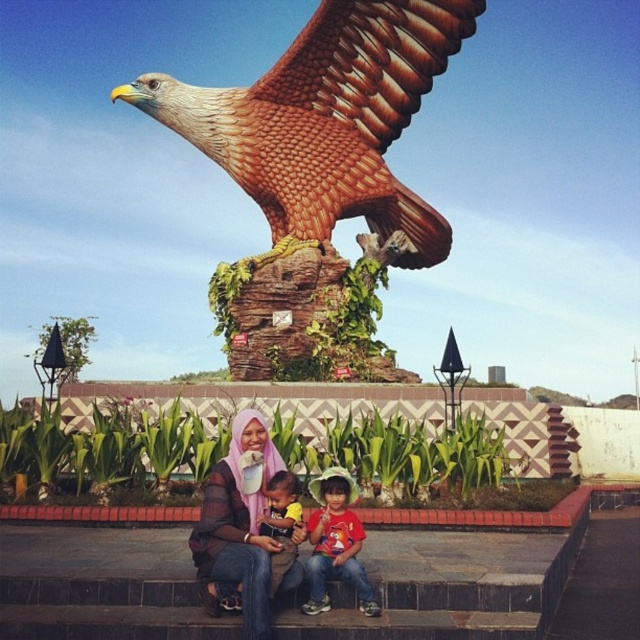
Locate an element on the screen. The height and width of the screenshot is (640, 640). brown glossy eagle at upper center is located at coordinates (326, 120).

In the scene shown: Does brown glossy eagle at upper center have a lesser width compared to red cotton shirt at center?

No, brown glossy eagle at upper center is not thinner than red cotton shirt at center.

Between point (326, 227) and point (346, 518), which one is positioned in front?

Point (346, 518) is more forward.

This screenshot has height=640, width=640. I want to click on brown glossy eagle at upper center, so click(x=326, y=120).

Who is higher up, red cotton shirt at center or soft yellow fabric shirt at center?

soft yellow fabric shirt at center is above.

Is point (360, 524) less distant than point (262, 518)?

No, (360, 524) is further to viewer.

Which is behind, point (340, 490) or point (285, 474)?

The point (285, 474) is behind.

I want to click on red cotton shirt at center, so click(x=336, y=548).

From the picture: Is brown glossy eagle at upper center behind pink sheer hijab at center?

Yes.

Who is more distant from viewer, [268,145] or [243,579]?

The point [268,145] is behind.

Find the location of a particular element. brown glossy eagle at upper center is located at coordinates (326, 120).